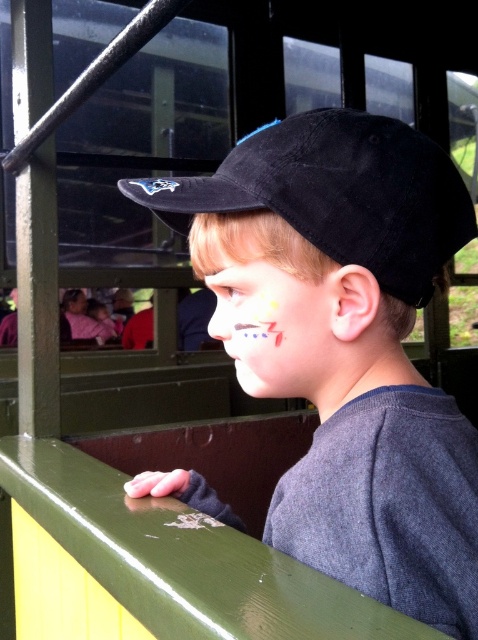
You are a tailor trying to fit a hat into a display case. The case has a width limit of 20 cm. You have two hats in front of you, the matte black cap at center and the black suede baseball cap at center. Which hat is wider and will not fit in the case?

The matte black cap at center is wider than the black suede baseball cap at center, so it will not fit in the 20 cm width display case.

You are a photographer trying to capture the black suede baseball cap at center in the image. If the camera is set to focus on the center of the image, will the cap be in focus?

The black suede baseball cap at center is located at point [337,193], which is not exactly the center of the image, so it might not be in focus if the camera is set to focus on the exact center.

The boy is sitting in a train car. He has a matte black cap at center and a matte paint face at center. Which object is located to the right of the other?

The matte black cap at center is positioned on the right side of matte paint face at center.